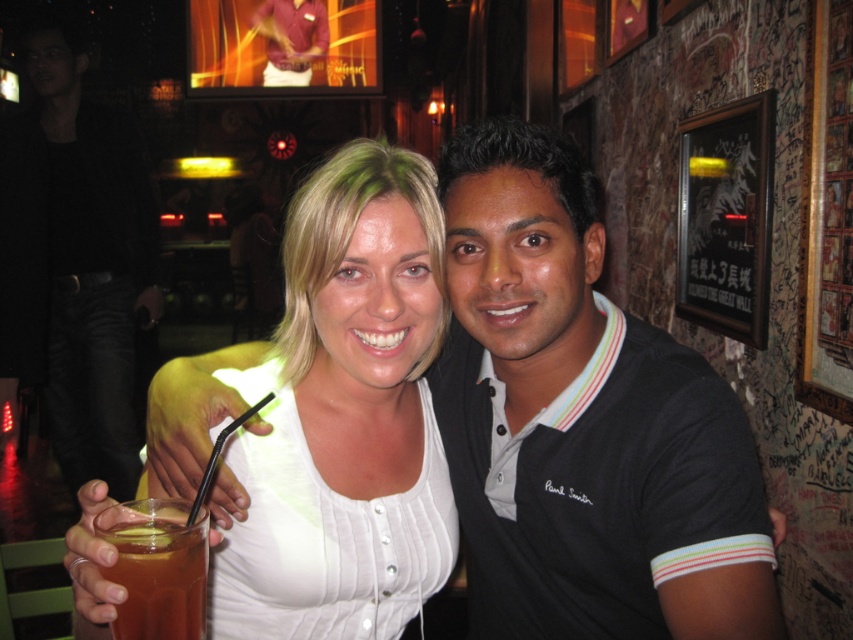
Does black cotton shirt at center have a greater width compared to translucent glass drink at lower left?

Yes, black cotton shirt at center is wider than translucent glass drink at lower left.

Between point (134, 145) and point (199, 586), which one is positioned behind?

Positioned behind is point (134, 145).

What are the coordinates of `black cotton shirt at center` in the screenshot? It's located at (74, 262).

What are the coordinates of `black cotton shirt at center` in the screenshot? It's located at (74, 262).

Is black cotton polo shirt at center above translucent glass at lower left?

Correct, black cotton polo shirt at center is located above translucent glass at lower left.

Can you confirm if black cotton polo shirt at center is bigger than translucent glass at lower left?

Yes.

In order to click on black cotton polo shirt at center in this screenshot , I will do `click(579, 420)`.

Find the location of a particular element. black cotton polo shirt at center is located at coordinates (579, 420).

Does white matte tank top at center have a greater width compared to translucent glass at lower left?

Indeed, white matte tank top at center has a greater width compared to translucent glass at lower left.

The width and height of the screenshot is (853, 640). What do you see at coordinates (345, 417) in the screenshot?
I see `white matte tank top at center` at bounding box center [345, 417].

Which is in front, point (389, 289) or point (183, 627)?

Point (183, 627) is more forward.

You are a GUI agent. You are given a task and a screenshot of the screen. Output one action in this format:
    pyautogui.click(x=<x>, y=<y>)
    Task: Click on the white matte tank top at center
    
    Given the screenshot: What is the action you would take?
    pyautogui.click(x=345, y=417)